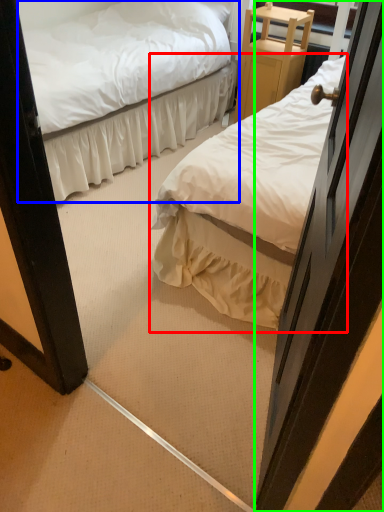
Question: Considering the real-world distances, which object is farthest from bed (highlighted by a red box)? bed (highlighted by a blue box) or door (highlighted by a green box)?

Choices:
 (A) bed
 (B) door

Answer: (A)